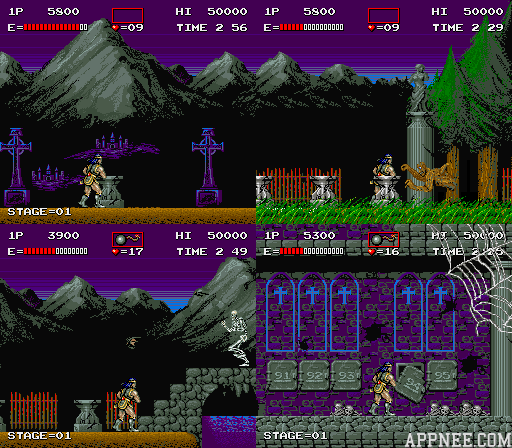
In order to click on pillar in this screenshot , I will do pos(490,350).